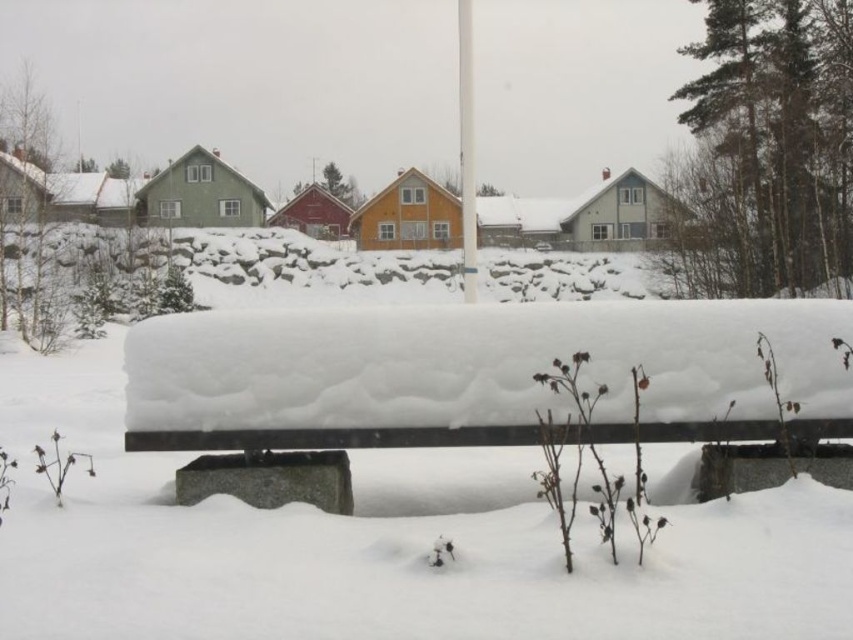
Looking at this image, you are planning to place a small potted plant between the concrete bench at center and the white plastic pole at center. Which object should you place the plant closer to to ensure it fits within the space?

The concrete bench at center is wider than the white plastic pole at center. To ensure the plant fits, place it closer to the white plastic pole at center since it has a narrower width, allowing more space for the plant.

You are standing in the winter scene and want to place a small snowman between the two points, point [827,433] and point [461,74]. Which point should you start building the snowman closer to so it appears larger in the image?

You should start building the snowman closer to point [827,433] because it is closer to the camera, making the snowman appear larger in the image.